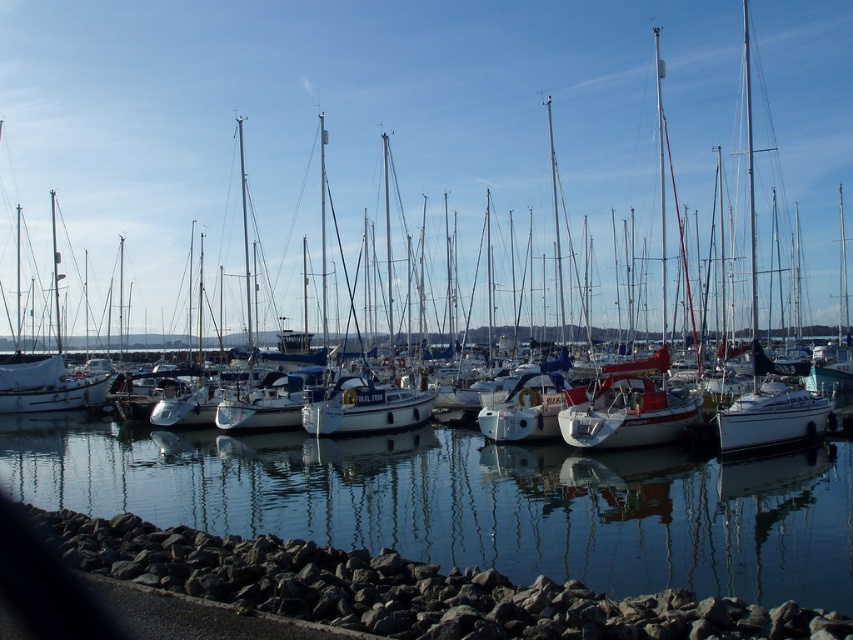
Question: Does clear water at center have a greater width compared to white glossy boat at center?

Choices:
 (A) yes
 (B) no

Answer: (A)

Question: Which object is the closest to the white glossy sailboat at center?

Choices:
 (A) white glossy boat at center
 (B) clear water at center

Answer: (A)

Question: Where is white glossy sailboat at center located in relation to clear water at center in the image?

Choices:
 (A) right
 (B) left

Answer: (B)

Question: Which point is farther to the camera?

Choices:
 (A) white glossy sailboat at center
 (B) clear water at center

Answer: (A)

Question: Observing the image, what is the correct spatial positioning of white glossy sailboat at center in reference to clear water at center?

Choices:
 (A) above
 (B) below

Answer: (A)

Question: Which object is farther from the camera taking this photo?

Choices:
 (A) white glossy sailboat at center
 (B) white glossy boat at center
 (C) clear water at center

Answer: (A)